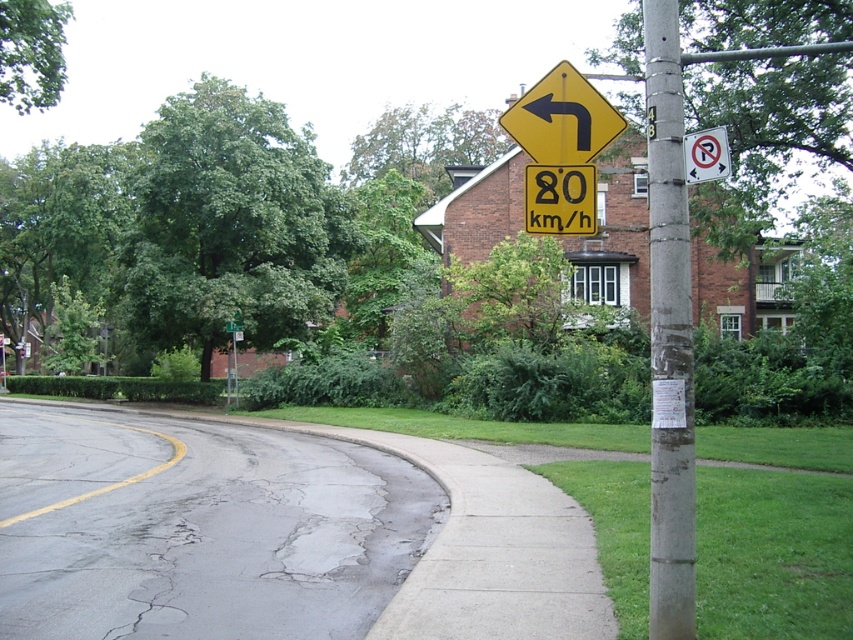
Question: Which object is positioned closest to the yellow matte sign at upper center?

Choices:
 (A) concrete pole at right
 (B) green plastic street sign at upper center
 (C) gray asphalt road at lower left

Answer: (A)

Question: Is gray asphalt road at lower left positioned behind yellow matte sign at upper center?

Choices:
 (A) yes
 (B) no

Answer: (A)

Question: Considering the real-world distances, which object is closest to the gray asphalt road at lower left?

Choices:
 (A) concrete pole at right
 (B) yellow matte sign at upper center
 (C) white plastic no parking sign at upper right
 (D) yellow plastic speed limit sign at upper center

Answer: (B)

Question: Does gray asphalt road at lower left appear under yellow matte sign at upper center?

Choices:
 (A) yes
 (B) no

Answer: (A)

Question: Does yellow matte sign at upper center have a lesser width compared to white plastic no parking sign at upper right?

Choices:
 (A) yes
 (B) no

Answer: (B)

Question: Which of these objects is positioned farthest from the concrete pole at right?

Choices:
 (A) yellow matte sign at upper center
 (B) gray asphalt road at lower left
 (C) yellow plastic speed limit sign at upper center

Answer: (B)